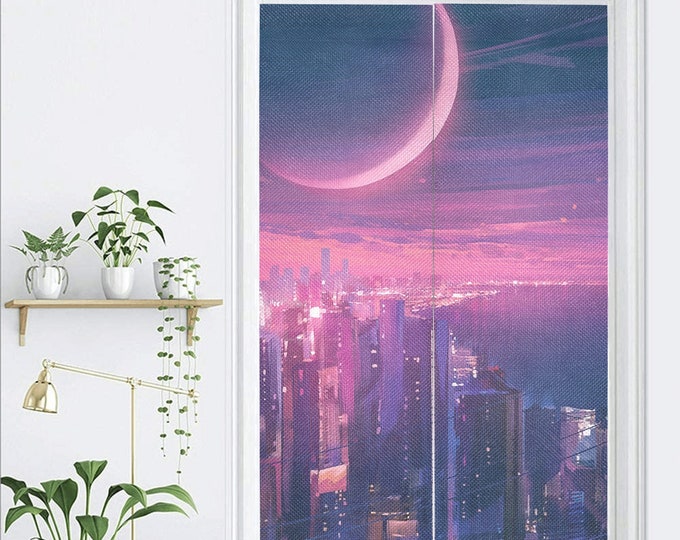
Where is `light brown wooden shelf`? This screenshot has width=680, height=540. light brown wooden shelf is located at coordinates (20, 303).